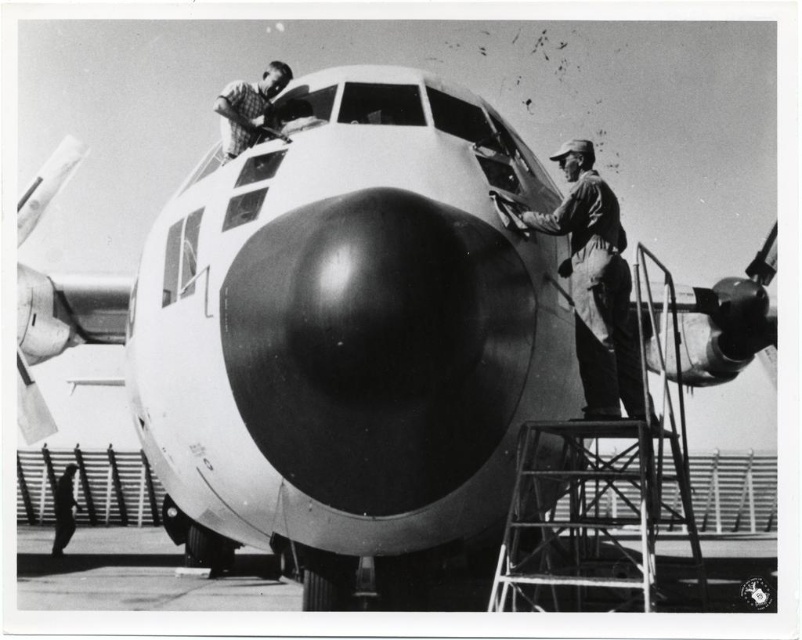
You are standing in front of the aircraft and notice two points marked on the image. The first point is at coordinate point (602, 243) and the second is at point (240, 140). Which point is nearer to you?

Point (602, 243) is closer to the viewer than point (240, 140).

Based on the scene description and the coordinates provided, can you identify the object located at point (x=246, y=108)?

The object at point (x=246, y=108) is the brushed metal airplane at upper center.

You are a technician standing at the point marked by the coordinates point (596, 285). Looking at the aircraft nose in the foreground, which direction should you face to see the dark gray uniform at center?

The point (596, 285) marks the location of the dark gray uniform at center, so you are already facing it. Therefore, you should face forward to see the dark gray uniform at center.